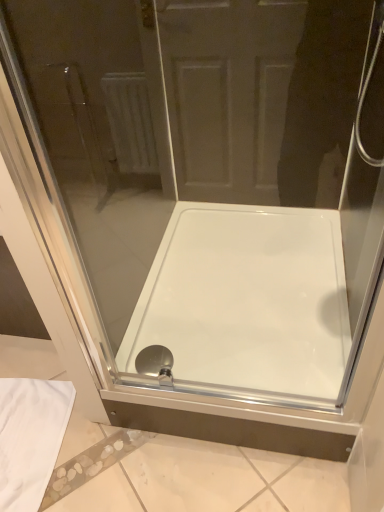
Question: Can you confirm if matte silver showerhead at bottom center is smaller than white glossy bathtub at center?

Choices:
 (A) yes
 (B) no

Answer: (A)

Question: From the image's perspective, is matte silver showerhead at bottom center located above white glossy bathtub at center?

Choices:
 (A) no
 (B) yes

Answer: (A)

Question: Would you say white glossy bathtub at center is part of matte silver showerhead at bottom center's contents?

Choices:
 (A) yes
 (B) no

Answer: (B)

Question: Does matte silver showerhead at bottom center come behind white glossy bathtub at center?

Choices:
 (A) no
 (B) yes

Answer: (B)

Question: From a real-world perspective, is matte silver showerhead at bottom center located beneath white glossy bathtub at center?

Choices:
 (A) yes
 (B) no

Answer: (B)

Question: Is matte silver showerhead at bottom center taller than white glossy bathtub at center?

Choices:
 (A) no
 (B) yes

Answer: (A)

Question: Is white glossy bathtub at center shorter than matte silver showerhead at bottom center?

Choices:
 (A) yes
 (B) no

Answer: (B)

Question: Is white glossy bathtub at center positioned far away from matte silver showerhead at bottom center?

Choices:
 (A) yes
 (B) no

Answer: (B)

Question: Is white glossy bathtub at center outside matte silver showerhead at bottom center?

Choices:
 (A) no
 (B) yes

Answer: (B)

Question: From a real-world perspective, is white glossy bathtub at center on top of matte silver showerhead at bottom center?

Choices:
 (A) yes
 (B) no

Answer: (B)

Question: From the image's perspective, is white glossy bathtub at center under matte silver showerhead at bottom center?

Choices:
 (A) yes
 (B) no

Answer: (B)

Question: Can you confirm if white glossy bathtub at center is bigger than matte silver showerhead at bottom center?

Choices:
 (A) no
 (B) yes

Answer: (B)

Question: Is matte silver showerhead at bottom center wider or thinner than white glossy bathtub at center?

Choices:
 (A) wide
 (B) thin

Answer: (B)